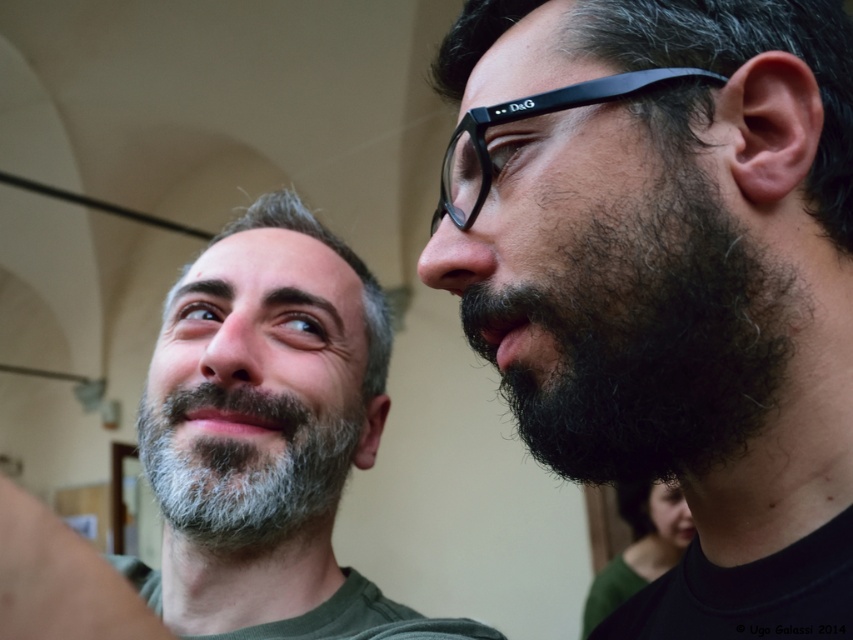
Question: Does dark brown hair at right have a larger size compared to black plastic glasses at upper right?

Choices:
 (A) no
 (B) yes

Answer: (B)

Question: Does dark brown curly beard at right have a lesser width compared to black plastic glasses at upper right?

Choices:
 (A) no
 (B) yes

Answer: (A)

Question: Is dark brown hair at right to the right of black plastic glasses at upper right from the viewer's perspective?

Choices:
 (A) no
 (B) yes

Answer: (B)

Question: Which point is closer to the camera?

Choices:
 (A) black plastic glasses at upper right
 (B) graywoollybeard at left
 (C) gray beard at left

Answer: (A)

Question: Which point is farther to the camera?

Choices:
 (A) (215, 474)
 (B) (457, 212)
 (C) (607, 467)
 (D) (177, 500)

Answer: (D)

Question: Which object is the farthest from the gray beard at left?

Choices:
 (A) graywoollybeard at left
 (B) dark brown hair at right

Answer: (B)